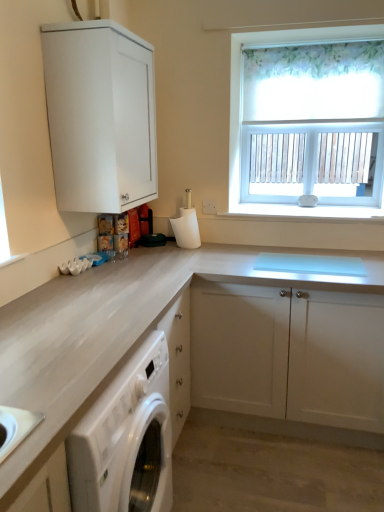
What is the approximate height of white glossy washing machine at lower left?

white glossy washing machine at lower left is 32.55 inches tall.

Describe the element at coordinates (164, 298) in the screenshot. I see `white matte cabinet at center, positioned as the 2th cabinetry in top-to-bottom order` at that location.

At what (x,y) coordinates should I click in order to perform the action: click on white matte cabinet at upper left, placed as the second cabinetry when sorted from bottom to top. Please return your answer as a coordinate pair (x, y). Looking at the image, I should click on (100, 116).

Locate an element on the screen. Image resolution: width=384 pixels, height=512 pixels. white floral roller blind at upper right is located at coordinates 241,95.

From the image's perspective, would you say white matte cabinet at center, positioned as the 2th cabinetry in top-to-bottom order, is positioned over white glossy washing machine at lower left?

Yes.

From a real-world perspective, is white matte cabinet at center, the 1th cabinetry from the bottom, located beneath white glossy washing machine at lower left?

No, from a real-world perspective, white matte cabinet at center, the 1th cabinetry from the bottom, is not under white glossy washing machine at lower left.

Relative to white glossy washing machine at lower left, is white matte cabinet at center, the 1th cabinetry from the bottom, in front or behind?

In the image, white matte cabinet at center, the 1th cabinetry from the bottom, appears behind white glossy washing machine at lower left.

Between white matte cabinet at upper left, placed as the second cabinetry when sorted from bottom to top, and white floral roller blind at upper right, which one is positioned in front?

white matte cabinet at upper left, placed as the second cabinetry when sorted from bottom to top.

The image size is (384, 512). I want to click on the 2nd cabinetry in front of the white floral roller blind at upper right, counting from the anchor's position, so click(100, 116).

Can you confirm if white matte cabinet at upper left, placed as the second cabinetry when sorted from bottom to top, is smaller than white floral roller blind at upper right?

Incorrect, white matte cabinet at upper left, placed as the second cabinetry when sorted from bottom to top, is not smaller in size than white floral roller blind at upper right.

From a real-world perspective, is white matte cabinet at upper left, marked as the 1th cabinetry in a top-to-bottom arrangement, above or below white floral roller blind at upper right?

From a real-world perspective, white matte cabinet at upper left, marked as the 1th cabinetry in a top-to-bottom arrangement, is physically above white floral roller blind at upper right.

Considering the relative sizes of white matte cabinet at upper left, placed as the second cabinetry when sorted from bottom to top, and white matte cabinet at center, positioned as the 2th cabinetry in top-to-bottom order, in the image provided, is white matte cabinet at upper left, placed as the second cabinetry when sorted from bottom to top, thinner than white matte cabinet at center, positioned as the 2th cabinetry in top-to-bottom order,?

Yes, white matte cabinet at upper left, placed as the second cabinetry when sorted from bottom to top, is thinner than white matte cabinet at center, positioned as the 2th cabinetry in top-to-bottom order.

Would you consider white matte cabinet at upper left, marked as the 1th cabinetry in a top-to-bottom arrangement, to be distant from white matte cabinet at center, positioned as the 2th cabinetry in top-to-bottom order?

No, white matte cabinet at upper left, marked as the 1th cabinetry in a top-to-bottom arrangement, is not far away from white matte cabinet at center, positioned as the 2th cabinetry in top-to-bottom order.

Looking at the image, does white matte cabinet at upper left, placed as the second cabinetry when sorted from bottom to top, seem bigger or smaller compared to white matte cabinet at center, the 1th cabinetry from the bottom?

white matte cabinet at upper left, placed as the second cabinetry when sorted from bottom to top, is smaller than white matte cabinet at center, the 1th cabinetry from the bottom.

From a real-world perspective, is white floral roller blind at upper right positioned under white glossy washing machine at lower left based on gravity?

Actually, white floral roller blind at upper right is physically above white glossy washing machine at lower left in the real world.

What's the angular difference between white floral roller blind at upper right and white glossy washing machine at lower left's facing directions?

89.9 degrees.

Does white floral roller blind at upper right turn towards white glossy washing machine at lower left?

Yes, white floral roller blind at upper right is oriented towards white glossy washing machine at lower left.

How distant is white floral roller blind at upper right from white glossy washing machine at lower left?

They are 1.54 meters apart.

Is white matte cabinet at center, the 1th cabinetry from the bottom, wider than white matte cabinet at upper left, marked as the 1th cabinetry in a top-to-bottom arrangement?

Indeed, white matte cabinet at center, the 1th cabinetry from the bottom, has a greater width compared to white matte cabinet at upper left, marked as the 1th cabinetry in a top-to-bottom arrangement.

Considering the sizes of objects white matte cabinet at center, positioned as the 2th cabinetry in top-to-bottom order, and white matte cabinet at upper left, marked as the 1th cabinetry in a top-to-bottom arrangement, in the image provided, who is taller, white matte cabinet at center, positioned as the 2th cabinetry in top-to-bottom order, or white matte cabinet at upper left, marked as the 1th cabinetry in a top-to-bottom arrangement,?

Standing taller between the two is white matte cabinet at center, positioned as the 2th cabinetry in top-to-bottom order.

Looking at the image, does white matte cabinet at center, positioned as the 2th cabinetry in top-to-bottom order, seem bigger or smaller compared to white matte cabinet at upper left, placed as the second cabinetry when sorted from bottom to top?

Clearly, white matte cabinet at center, positioned as the 2th cabinetry in top-to-bottom order, is larger in size than white matte cabinet at upper left, placed as the second cabinetry when sorted from bottom to top.

Image resolution: width=384 pixels, height=512 pixels. Identify the location of cabinetry on the left of white matte cabinet at center, positioned as the 2th cabinetry in top-to-bottom order. coord(100,116).

From the picture: Is white floral roller blind at upper right surrounding white matte cabinet at upper left, marked as the 1th cabinetry in a top-to-bottom arrangement?

No, white matte cabinet at upper left, marked as the 1th cabinetry in a top-to-bottom arrangement, is not a part of white floral roller blind at upper right.

Does white floral roller blind at upper right touch white matte cabinet at upper left, placed as the second cabinetry when sorted from bottom to top?

No, white floral roller blind at upper right is not next to white matte cabinet at upper left, placed as the second cabinetry when sorted from bottom to top.

Is white floral roller blind at upper right closer to camera compared to white matte cabinet at upper left, marked as the 1th cabinetry in a top-to-bottom arrangement?

No, it is not.

How many degrees apart are the facing directions of white floral roller blind at upper right and white matte cabinet at upper left, marked as the 1th cabinetry in a top-to-bottom arrangement?

The angular difference between white floral roller blind at upper right and white matte cabinet at upper left, marked as the 1th cabinetry in a top-to-bottom arrangement, is 89.9 degrees.

How much distance is there between white floral roller blind at upper right and white matte cabinet at center, positioned as the 2th cabinetry in top-to-bottom order?

The distance of white floral roller blind at upper right from white matte cabinet at center, positioned as the 2th cabinetry in top-to-bottom order, is 36.89 inches.

Can you confirm if white floral roller blind at upper right is shorter than white matte cabinet at center, positioned as the 2th cabinetry in top-to-bottom order?

Incorrect, the height of white floral roller blind at upper right does not fall short of that of white matte cabinet at center, positioned as the 2th cabinetry in top-to-bottom order.

In the scene shown: Is white floral roller blind at upper right inside or outside of white matte cabinet at center, positioned as the 2th cabinetry in top-to-bottom order?

white floral roller blind at upper right is not enclosed by white matte cabinet at center, positioned as the 2th cabinetry in top-to-bottom order.

This screenshot has width=384, height=512. What are the coordinates of `window above the white matte cabinet at center, the 1th cabinetry from the bottom (from the image's perspective)` in the screenshot? It's located at (241, 95).

There is a white glossy washing machine at lower left. Identify the location of the 1st cabinetry above it (from the image's perspective). (164, 298).

The image size is (384, 512). I want to click on the 1st cabinetry below the white floral roller blind at upper right (from the image's perspective), so click(100, 116).

Looking at the image, which one is located further to white floral roller blind at upper right, white glossy washing machine at lower left or white matte cabinet at upper left, marked as the 1th cabinetry in a top-to-bottom arrangement?

white glossy washing machine at lower left.

From the image, which object appears to be farther from white glossy washing machine at lower left, white floral roller blind at upper right or white matte cabinet at center, the 1th cabinetry from the bottom?

The object further to white glossy washing machine at lower left is white floral roller blind at upper right.

When comparing their distances from white glossy washing machine at lower left, does white matte cabinet at upper left, placed as the second cabinetry when sorted from bottom to top, or white matte cabinet at center, positioned as the 2th cabinetry in top-to-bottom order, seem closer?

Among the two, white matte cabinet at center, positioned as the 2th cabinetry in top-to-bottom order, is located nearer to white glossy washing machine at lower left.

When comparing their distances from white floral roller blind at upper right, does white matte cabinet at center, positioned as the 2th cabinetry in top-to-bottom order, or white glossy washing machine at lower left seem closer?

white matte cabinet at center, positioned as the 2th cabinetry in top-to-bottom order, is closer to white floral roller blind at upper right.

Based on their spatial positions, is white matte cabinet at upper left, marked as the 1th cabinetry in a top-to-bottom arrangement, or white floral roller blind at upper right closer to white glossy washing machine at lower left?

white matte cabinet at upper left, marked as the 1th cabinetry in a top-to-bottom arrangement, is closer to white glossy washing machine at lower left.

Estimate the real-world distances between objects in this image. Which object is closer to white matte cabinet at center, the 1th cabinetry from the bottom, white glossy washing machine at lower left or white matte cabinet at upper left, marked as the 1th cabinetry in a top-to-bottom arrangement?

Based on the image, white glossy washing machine at lower left appears to be nearer to white matte cabinet at center, the 1th cabinetry from the bottom.

From the image, which object appears to be nearer to white glossy washing machine at lower left, white matte cabinet at center, the 1th cabinetry from the bottom, or white matte cabinet at upper left, marked as the 1th cabinetry in a top-to-bottom arrangement?

Among the two, white matte cabinet at center, the 1th cabinetry from the bottom, is located nearer to white glossy washing machine at lower left.

Looking at the image, which one is located closer to white glossy washing machine at lower left, white matte cabinet at center, positioned as the 2th cabinetry in top-to-bottom order, or white floral roller blind at upper right?

The object closer to white glossy washing machine at lower left is white matte cabinet at center, positioned as the 2th cabinetry in top-to-bottom order.

I want to click on cabinetry between white floral roller blind at upper right and white matte cabinet at center, positioned as the 2th cabinetry in top-to-bottom order, in the vertical direction, so click(100, 116).

Where is `cabinetry between white matte cabinet at upper left, placed as the second cabinetry when sorted from bottom to top, and white glossy washing machine at lower left, in the vertical direction`? This screenshot has width=384, height=512. cabinetry between white matte cabinet at upper left, placed as the second cabinetry when sorted from bottom to top, and white glossy washing machine at lower left, in the vertical direction is located at coordinates (164, 298).